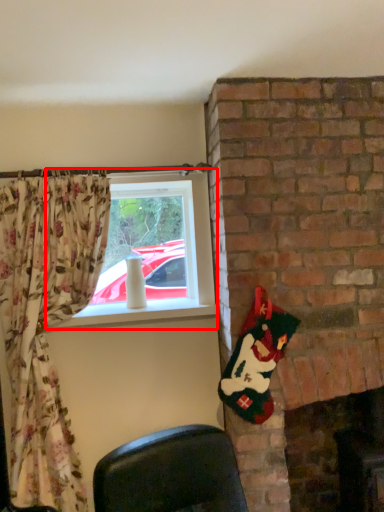
Question: Observing the image, what is the correct spatial positioning of window (annotated by the red box) in reference to fireplace?

Choices:
 (A) right
 (B) left

Answer: (B)